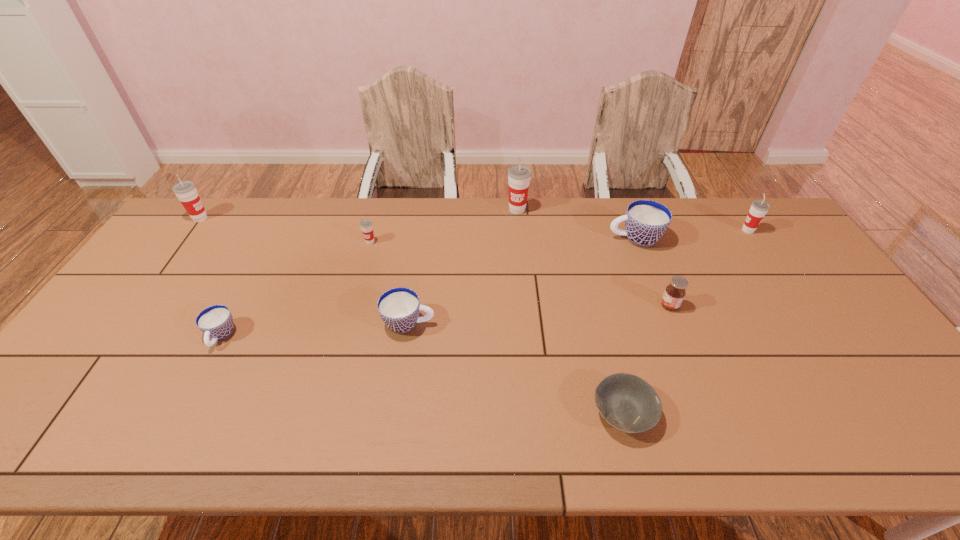
Find the location of a particular element. This screenshot has height=540, width=960. free space that satisfies the following two spatial constraints: 1. on the side of the fourth object from left to right with the handle; 2. on the side of the leftmost blue cup with the handle is located at coordinates (407, 336).

Locate an element on the screen. The height and width of the screenshot is (540, 960). blank space that satisfies the following two spatial constraints: 1. on the side of the third cup from right to left with the logo; 2. on the side of the second blue cup from left to right with the handle is located at coordinates (528, 323).

The height and width of the screenshot is (540, 960). I want to click on vacant space that satisfies the following two spatial constraints: 1. on the side of the second smallest red cup with the logo; 2. on the side of the nearest red cup with the logo, so click(756, 242).

The width and height of the screenshot is (960, 540). What are the coordinates of `free point that satisfies the following two spatial constraints: 1. on the side of the third cup from right to left with the logo; 2. on the side of the fourth object from left to right with the handle` in the screenshot? It's located at (528, 323).